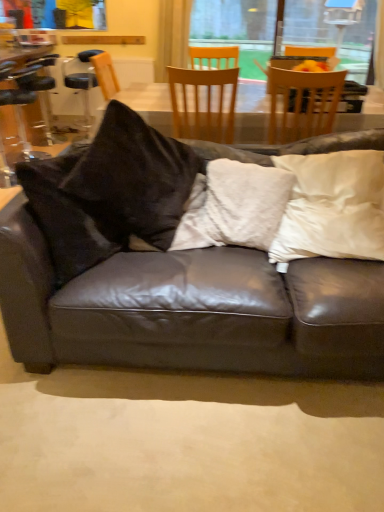
Question: Is matte black leather couch at center not near clear plastic bar stool at left?

Choices:
 (A) yes
 (B) no

Answer: (A)

Question: From the image's perspective, would you say matte black leather couch at center is shown under clear plastic bar stool at left?

Choices:
 (A) no
 (B) yes

Answer: (B)

Question: Can you confirm if matte black leather couch at center is wider than clear plastic bar stool at left?

Choices:
 (A) yes
 (B) no

Answer: (A)

Question: Can you confirm if matte black leather couch at center is bigger than clear plastic bar stool at left?

Choices:
 (A) yes
 (B) no

Answer: (A)

Question: Can you confirm if matte black leather couch at center is positioned to the right of clear plastic bar stool at left?

Choices:
 (A) no
 (B) yes

Answer: (B)

Question: From a real-world perspective, relative to matte black leather couch at center, is white fuzzy pillow at center, which is the first pillow in left-to-right order, vertically above or below?

Choices:
 (A) below
 (B) above

Answer: (B)

Question: Is white fuzzy pillow at center, which is the first pillow in left-to-right order, in front of or behind matte black leather couch at center in the image?

Choices:
 (A) behind
 (B) front

Answer: (A)

Question: Considering the positions of white fuzzy pillow at center, which is the first pillow in left-to-right order, and matte black leather couch at center in the image, is white fuzzy pillow at center, which is the first pillow in left-to-right order, bigger or smaller than matte black leather couch at center?

Choices:
 (A) big
 (B) small

Answer: (B)

Question: In terms of height, does white fuzzy pillow at center, which is the first pillow in left-to-right order, look taller or shorter compared to matte black leather couch at center?

Choices:
 (A) tall
 (B) short

Answer: (B)

Question: Visually, is matte black leather couch at center positioned to the left or to the right of wooden chair at center, which is the 2th chair from left to right?

Choices:
 (A) left
 (B) right

Answer: (B)

Question: Is matte black leather couch at center in front of or behind wooden chair at center, which is the 2th chair from left to right, in the image?

Choices:
 (A) behind
 (B) front

Answer: (B)

Question: Considering the positions of matte black leather couch at center and wooden chair at center, which is the 2th chair from left to right, in the image, is matte black leather couch at center wider or thinner than wooden chair at center, which is the 2th chair from left to right,?

Choices:
 (A) thin
 (B) wide

Answer: (B)

Question: From the image's perspective, is matte black leather couch at center located above or below wooden chair at center, the second chair positioned from the right?

Choices:
 (A) above
 (B) below

Answer: (B)

Question: Is point (311, 104) closer or farther from the camera than point (264, 190)?

Choices:
 (A) closer
 (B) farther

Answer: (B)

Question: From a real-world perspective, is wooden chair at upper center, the 3th chair positioned from the left, positioned above or below white fuzzy pillow at center, which is the first pillow in left-to-right order?

Choices:
 (A) above
 (B) below

Answer: (A)